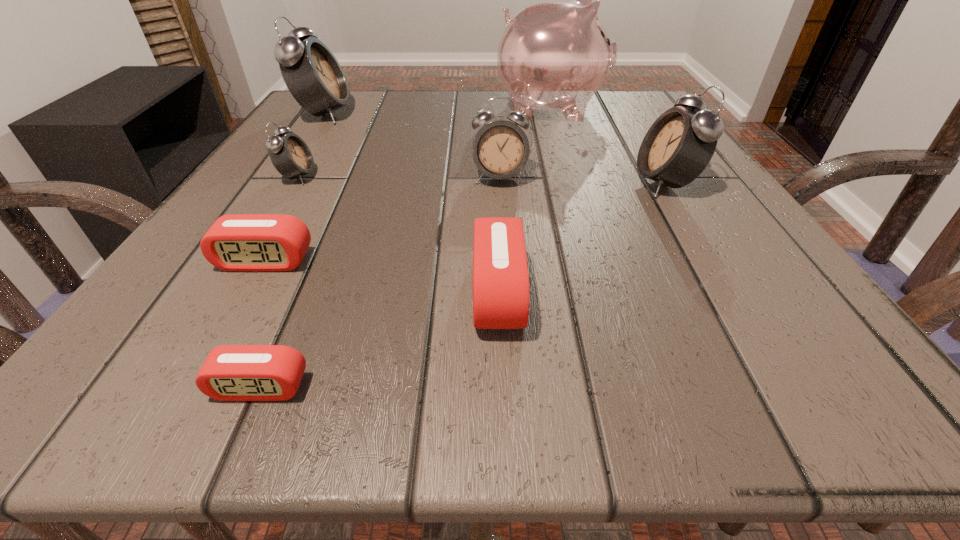
This screenshot has width=960, height=540. In order to click on vacant region located on the face of the second white alarm clock from right to left in this screenshot , I will do `click(511, 348)`.

I want to click on free space located 0.130m on the face of the fourth shortest object, so (x=394, y=177).

Image resolution: width=960 pixels, height=540 pixels. I want to click on vacant area situated 0.100m on the front-facing side of the rightmost pink alarm clock, so click(x=390, y=293).

Identify the location of vacant space located on the front-facing side of the rightmost pink alarm clock. This screenshot has width=960, height=540. (406, 293).

Where is `free space located 0.080m on the front-facing side of the rightmost pink alarm clock`? Image resolution: width=960 pixels, height=540 pixels. free space located 0.080m on the front-facing side of the rightmost pink alarm clock is located at coordinates (406, 293).

The image size is (960, 540). I want to click on vacant area situated on the front-facing side of the second smallest pink alarm clock, so click(x=216, y=349).

Locate an element on the screen. The width and height of the screenshot is (960, 540). piggy bank present at the far edge is located at coordinates (554, 56).

The height and width of the screenshot is (540, 960). I want to click on alarm clock present at the far edge, so click(314, 77).

This screenshot has width=960, height=540. I want to click on piggy bank positioned at the right edge, so click(554, 56).

Identify the location of alarm clock at the right edge. This screenshot has height=540, width=960. (679, 145).